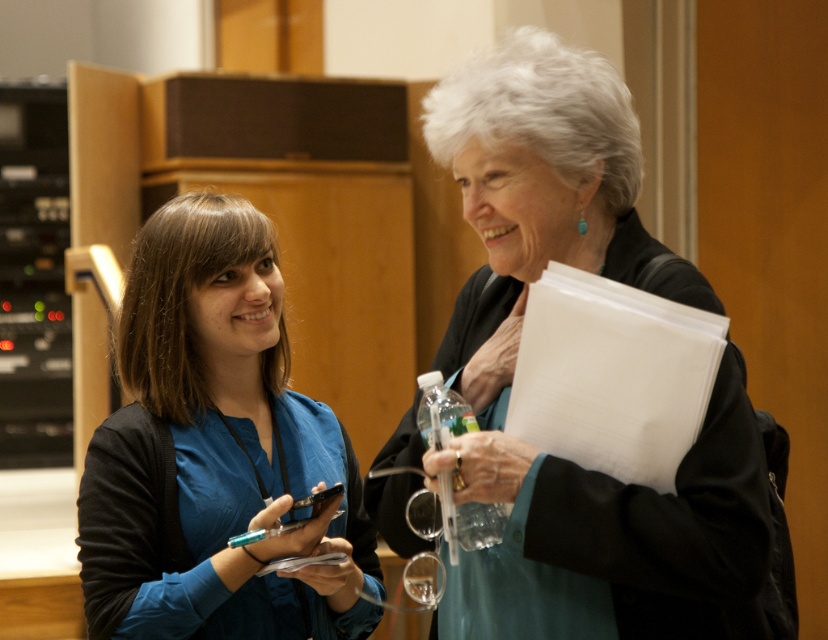
Which of these two, teal fabric jacket at center or blue fabric shirt at center, stands shorter?

Standing shorter between the two is blue fabric shirt at center.

Is point (607, 516) more distant than point (159, 333)?

No, (607, 516) is closer to viewer.

You are a GUI agent. You are given a task and a screenshot of the screen. Output one action in this format:
    pyautogui.click(x=<x>, y=<y>)
    Task: Click on the teal fabric jacket at center
    
    Given the screenshot: What is the action you would take?
    pyautogui.click(x=514, y=360)

Does blue fabric shirt at center have a larger size compared to clear plastic bottle at center?

Correct, blue fabric shirt at center is larger in size than clear plastic bottle at center.

Find the location of a particular element. blue fabric shirt at center is located at coordinates point(213,449).

What do you see at coordinates (213, 449) in the screenshot? The height and width of the screenshot is (640, 828). I see `blue fabric shirt at center` at bounding box center [213, 449].

Identify the location of blue fabric shirt at center. (213, 449).

Is teal fabric jacket at center shorter than clear plastic bottle at center?

No, teal fabric jacket at center is not shorter than clear plastic bottle at center.

Between teal fabric jacket at center and clear plastic bottle at center, which one is positioned higher?

teal fabric jacket at center is above.

This screenshot has height=640, width=828. In order to click on teal fabric jacket at center in this screenshot , I will do `click(514, 360)`.

This screenshot has height=640, width=828. I want to click on teal fabric jacket at center, so click(514, 360).